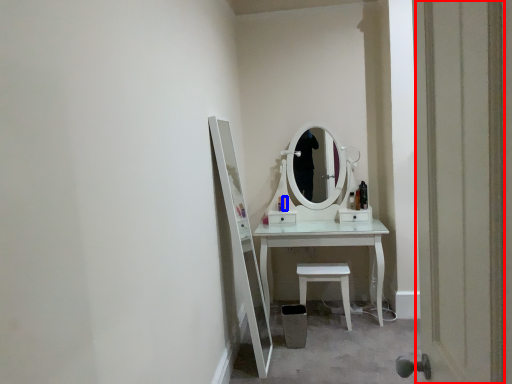
Question: Which of the following is the farthest to the observer, door (highlighted by a red box) or toiletry (highlighted by a blue box)?

Choices:
 (A) door
 (B) toiletry

Answer: (B)